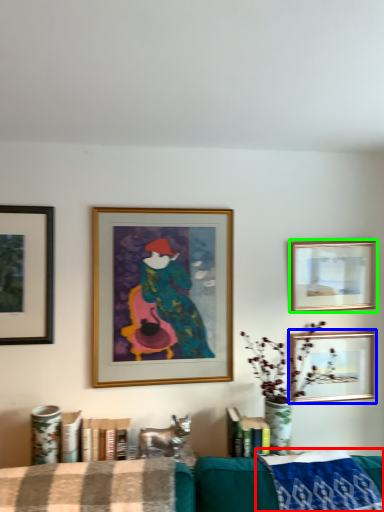
Question: Which object is positioned farthest from cloth (highlighted by a red box)? Select from picture frame (highlighted by a blue box) and picture frame (highlighted by a green box).

Choices:
 (A) picture frame
 (B) picture frame

Answer: (B)